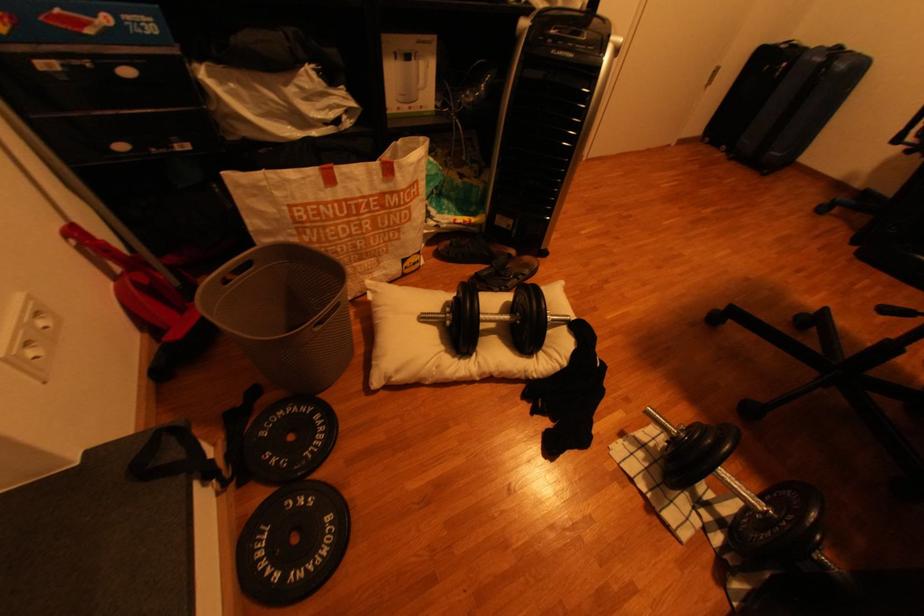
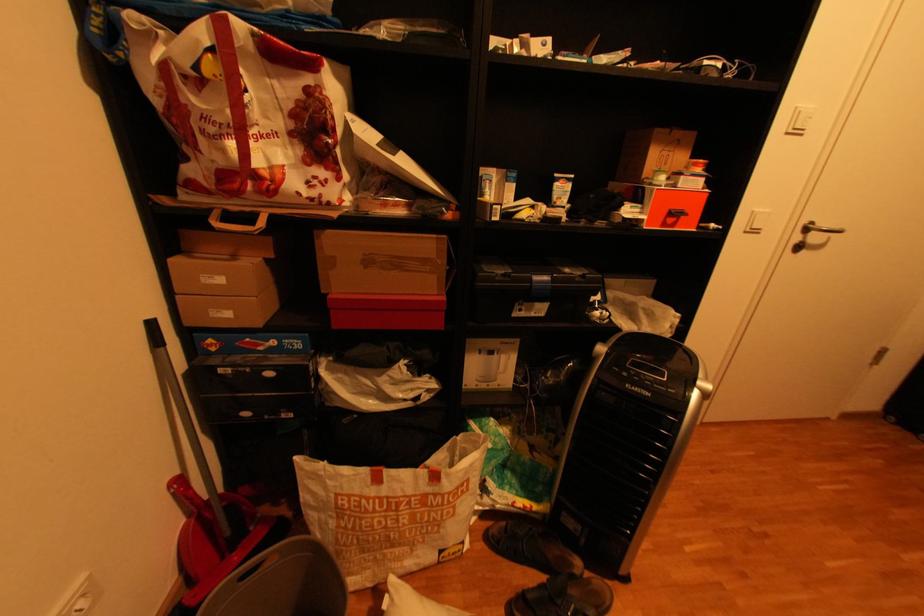
First-person continuous shooting, in which direction is the camera rotating?

The rotation direction of the camera is left-up.